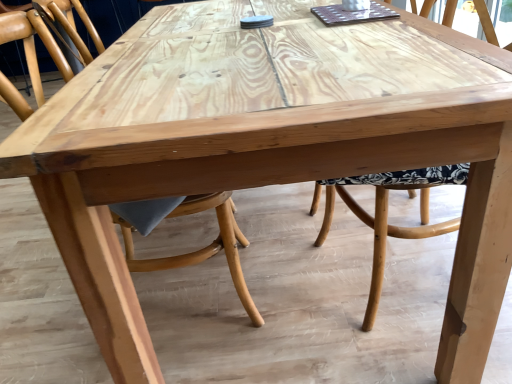
What is the approximate height of wooden chair at lower left?

wooden chair at lower left is 34.85 inches tall.

The image size is (512, 384). Describe the element at coordinates (203, 248) in the screenshot. I see `wooden chair at lower left` at that location.

Find the location of a particular element. The image size is (512, 384). wooden chair at lower left is located at coordinates point(203,248).

At what (x,y) coordinates should I click in order to perform the action: click on wooden chair at lower left. Please return your answer as a coordinate pair (x, y). This screenshot has height=384, width=512. Looking at the image, I should click on (203, 248).